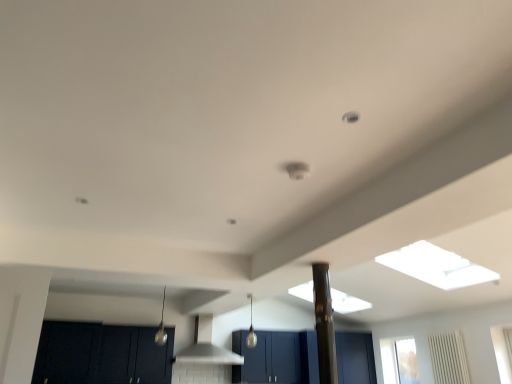
Question: Is black glossy pillar at center positioned in front of white matte vent at center?

Choices:
 (A) yes
 (B) no

Answer: (A)

Question: From a real-world perspective, is black glossy pillar at center located beneath white matte vent at center?

Choices:
 (A) yes
 (B) no

Answer: (A)

Question: From the image's perspective, does black glossy pillar at center appear lower than white matte vent at center?

Choices:
 (A) no
 (B) yes

Answer: (A)

Question: Is black glossy pillar at center turned away from white matte vent at center?

Choices:
 (A) yes
 (B) no

Answer: (B)

Question: From the image's perspective, is black glossy pillar at center located above white matte vent at center?

Choices:
 (A) no
 (B) yes

Answer: (B)

Question: Considering the positions of white matte vent at center and matte black cabinets at lower left, positioned as the 2th cabinetry in left-to-right order, in the image, is white matte vent at center wider or thinner than matte black cabinets at lower left, positioned as the 2th cabinetry in left-to-right order,?

Choices:
 (A) wide
 (B) thin

Answer: (A)

Question: From the image's perspective, is white matte vent at center located above or below matte black cabinets at lower left, the second cabinetry positioned from the right?

Choices:
 (A) above
 (B) below

Answer: (A)

Question: Is point (230, 360) positioned closer to the camera than point (98, 359)?

Choices:
 (A) farther
 (B) closer

Answer: (B)

Question: From their relative heights in the image, would you say white matte vent at center is taller or shorter than matte black cabinets at lower left, the second cabinetry positioned from the right?

Choices:
 (A) tall
 (B) short

Answer: (B)

Question: From the image's perspective, relative to white matte vent at center, is matte blue cabinet at center, marked as the first cabinetry in a right-to-left arrangement, above or below?

Choices:
 (A) above
 (B) below

Answer: (B)

Question: Visually, is matte blue cabinet at center, positioned as the 3th cabinetry in left-to-right order, positioned to the left or to the right of white matte vent at center?

Choices:
 (A) right
 (B) left

Answer: (A)

Question: From a real-world perspective, is matte blue cabinet at center, positioned as the 3th cabinetry in left-to-right order, positioned above or below white matte vent at center?

Choices:
 (A) above
 (B) below

Answer: (B)

Question: Is matte blue cabinet at center, marked as the first cabinetry in a right-to-left arrangement, inside or outside of white matte vent at center?

Choices:
 (A) inside
 (B) outside

Answer: (B)

Question: From their relative heights in the image, would you say dark wood cabinet at lower left, the first cabinetry positioned from the left, is taller or shorter than matte black cabinets at lower left, the second cabinetry positioned from the right?

Choices:
 (A) tall
 (B) short

Answer: (B)

Question: In the image, is dark wood cabinet at lower left, the first cabinetry positioned from the left, on the left side or the right side of matte black cabinets at lower left, positioned as the 2th cabinetry in left-to-right order?

Choices:
 (A) right
 (B) left

Answer: (B)